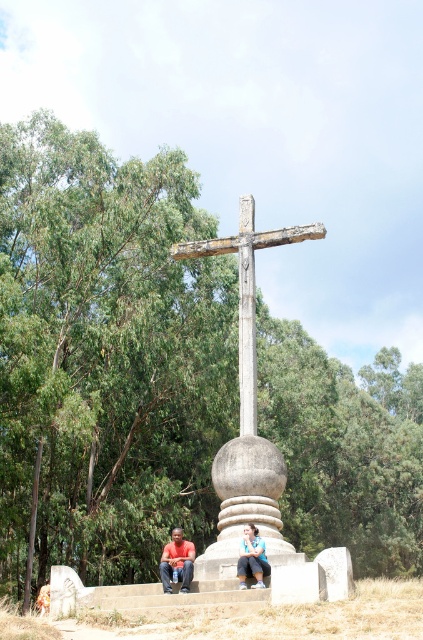
You are standing in front of the monument and want to take a photo of the weathered wood cross at center and the matte orange shirt at lower center. Which object should you frame first in your camera viewfinder to ensure both are in the shot?

The matte orange shirt at lower center should be framed first since the weathered wood cross at center is to the right of it, so positioning the shirt first allows the cross to naturally come into frame to its right.

You are standing at the base of the large stone cross monument and want to find the person wearing matte black clothing at center. According to the image, where would you look relative to the cross?

The person wearing matte black clothing at center is located at the coordinates point (176, 563), which is to the right side of the cross monument.

You are a photographer trying to capture a photo of the matte black clothing at center and the matte orange shirt at lower center. Based on their positions, which one should you focus on first if you want to include both in the frame without moving the camera?

The matte orange shirt at lower center should be focused on first because the matte black clothing at center is positioned to its right side, so adjusting focus to the left would ensure both are in frame.